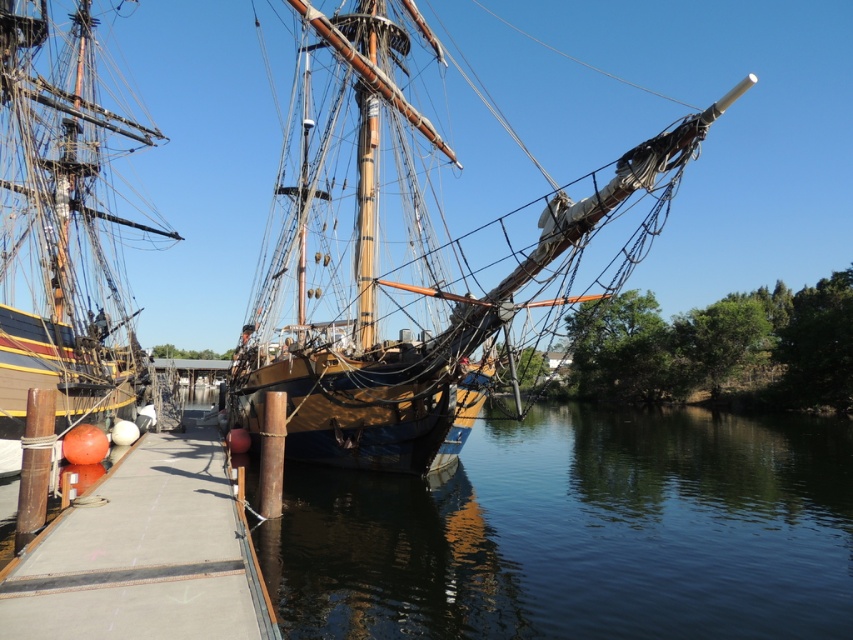
Question: Is wooden ship at left behind concrete at center?

Choices:
 (A) yes
 (B) no

Answer: (A)

Question: Which point is closer to the camera taking this photo?

Choices:
 (A) (82, 42)
 (B) (172, 625)
 (C) (392, 236)
 (D) (628, 508)

Answer: (B)

Question: Which object appears farthest from the camera in this image?

Choices:
 (A) wooden ship at center
 (B) wooden ship at left

Answer: (B)

Question: Does wooden ship at center appear on the left side of wooden ship at left?

Choices:
 (A) no
 (B) yes

Answer: (A)

Question: Based on their relative distances, which object is nearer to the concrete at center?

Choices:
 (A) dark reflective water at center
 (B) wooden ship at center

Answer: (A)

Question: Does wooden ship at center have a lesser width compared to wooden ship at left?

Choices:
 (A) no
 (B) yes

Answer: (A)